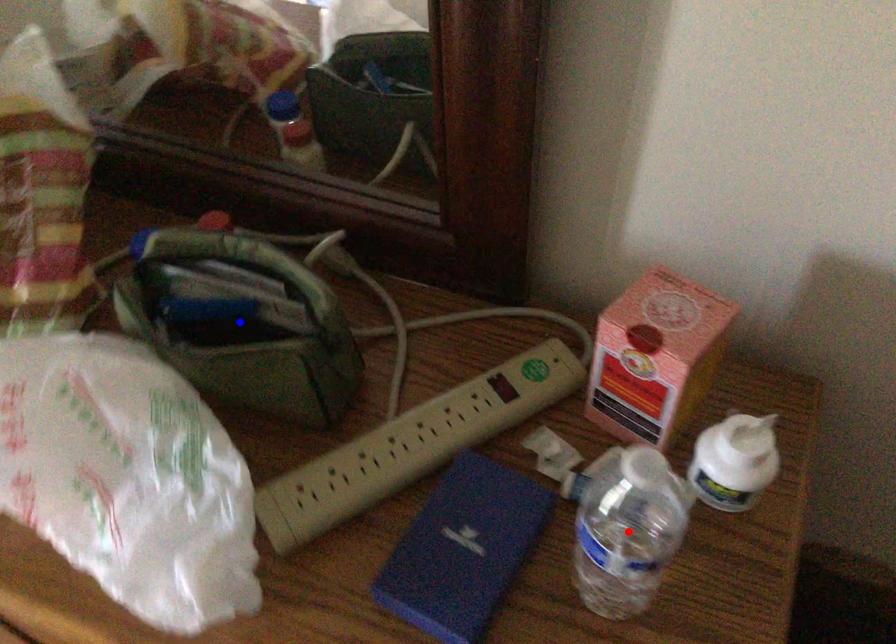
Question: In the image, two points are highlighted. Which point is nearer to the camera? Reply with the corresponding letter.

Choices:
 (A) blue point
 (B) red point

Answer: (B)